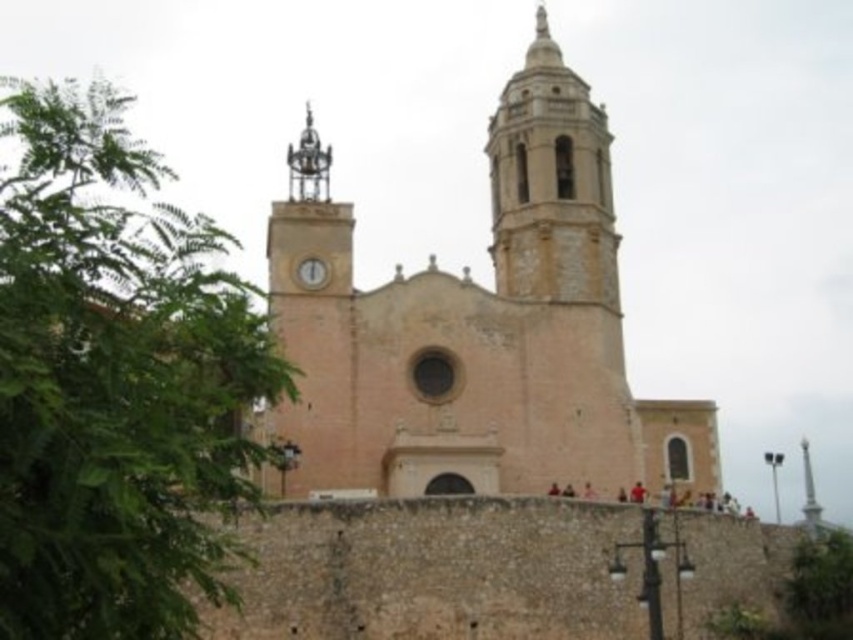
Does smooth beige bell tower at upper center have a lesser width compared to white glossy clock at center?

Incorrect, smooth beige bell tower at upper center's width is not less than white glossy clock at center's.

Which is in front, point (561, 160) or point (318, 282)?

Point (318, 282)

Find the location of a particular element. This screenshot has width=853, height=640. smooth beige bell tower at upper center is located at coordinates (550, 182).

Does green leafy tree at left have a greater height compared to smooth beige bell tower at upper center?

Yes, green leafy tree at left is taller than smooth beige bell tower at upper center.

Who is more forward, (80, 204) or (538, 218)?

Point (80, 204) is more forward.

Describe the element at coordinates (114, 380) in the screenshot. I see `green leafy tree at left` at that location.

Image resolution: width=853 pixels, height=640 pixels. I want to click on green leafy tree at left, so click(x=114, y=380).

Does green leafy tree at left appear on the left side of white glossy clock at center?

Correct, you'll find green leafy tree at left to the left of white glossy clock at center.

The width and height of the screenshot is (853, 640). What do you see at coordinates (114, 380) in the screenshot? I see `green leafy tree at left` at bounding box center [114, 380].

Find the location of a particular element. The width and height of the screenshot is (853, 640). green leafy tree at left is located at coordinates (114, 380).